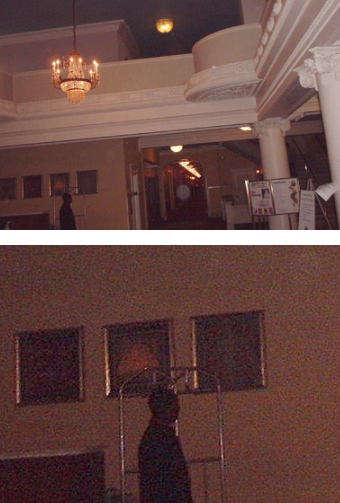
The width and height of the screenshot is (340, 503). I want to click on rack clothes, so click(x=123, y=417).